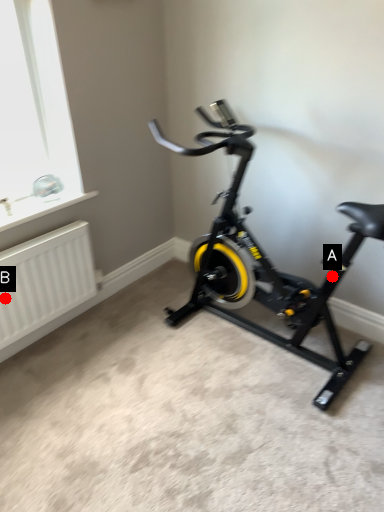
Question: Two points are circled on the image, labeled by A and B beside each circle. Which point is further to the camera?

Choices:
 (A) A is further
 (B) B is further

Answer: (B)